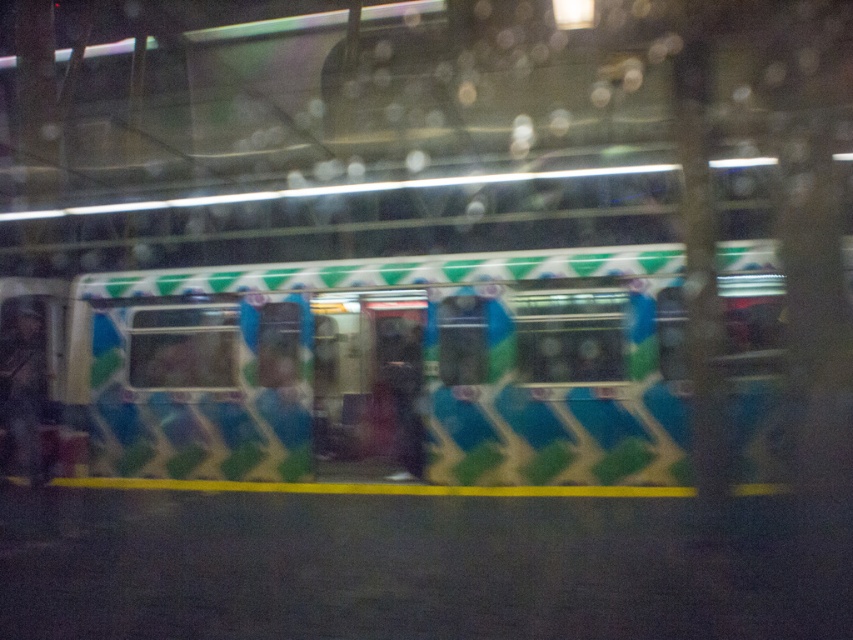
You are a passenger waiting at the train station. You notice the matte green and blue train at center and the matte blue jacket at left. Which object appears bigger in the scene?

The matte green and blue train at center is larger in size than the matte blue jacket at left, so the matte green and blue train at center appears bigger.

You are standing at the train station and see the point marked at coordinates [381,365]. What object is located at that point?

The point at [381,365] indicates the matte green and blue train at center.